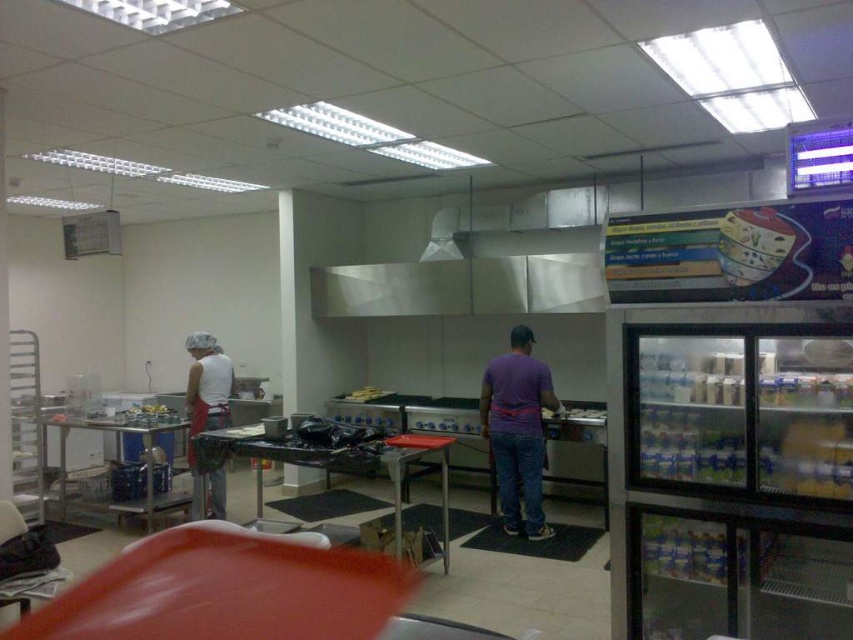
Question: Is purple matte shirt at center bigger than stainless steel exhaust hood at upper center?

Choices:
 (A) yes
 (B) no

Answer: (A)

Question: Is purple matte shirt at center wider than stainless steel exhaust hood at upper center?

Choices:
 (A) no
 (B) yes

Answer: (B)

Question: Which is nearer to the purple matte shirt at center?

Choices:
 (A) white matte apron at left
 (B) stainless steel exhaust hood at upper center

Answer: (B)

Question: Can you confirm if white matte apron at left is positioned to the left of stainless steel exhaust hood at upper center?

Choices:
 (A) no
 (B) yes

Answer: (B)

Question: Which point is closer to the camera?

Choices:
 (A) stainless steel exhaust hood at upper center
 (B) white matte apron at left

Answer: (B)

Question: Which point is farther from the camera taking this photo?

Choices:
 (A) (206, 337)
 (B) (503, 515)
 (C) (448, 253)

Answer: (C)